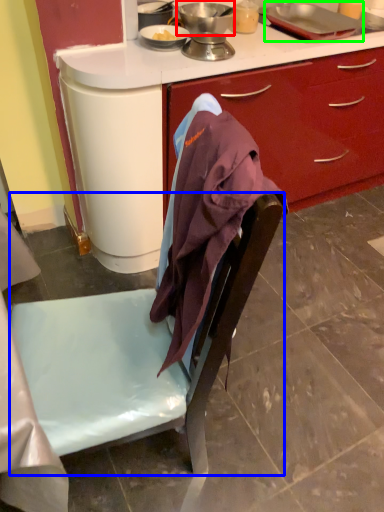
Question: Estimate the real-world distances between objects in this image. Which object is farther from kitchen appliance (highlighted by a red box), chair (highlighted by a blue box) or kitchen appliance (highlighted by a green box)?

Choices:
 (A) chair
 (B) kitchen appliance

Answer: (A)